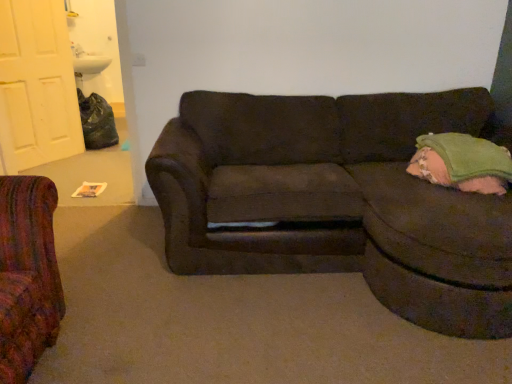
Question: Is green fabric pillow at right wider or thinner than dark brown fabric couch at center?

Choices:
 (A) thin
 (B) wide

Answer: (A)

Question: In terms of height, does green fabric pillow at right look taller or shorter compared to dark brown fabric couch at center?

Choices:
 (A) tall
 (B) short

Answer: (B)

Question: Which object is the closest to the dark brown fabric couch at center?

Choices:
 (A) white matte door at upper left
 (B) green fabric pillow at right

Answer: (B)

Question: Considering the real-world distances, which object is farthest from the dark brown fabric couch at center?

Choices:
 (A) green fabric pillow at right
 (B) white matte door at upper left

Answer: (B)